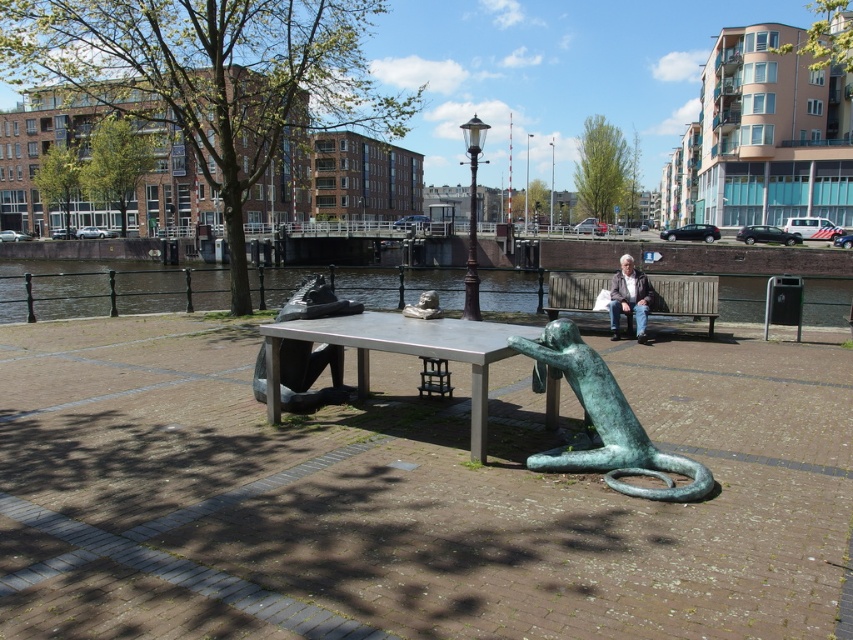
You are an artist planning to place a new sculpture between the polished stone statue at center and the matte brown jacket at center. Based on their widths, which object should you use as a reference to ensure the new sculpture fits proportionally?

The polished stone statue at center is thinner than the matte brown jacket at center, so you should use the matte brown jacket at center as the reference for the wider side to ensure the new sculpture fits proportionally.

In the scene shown: You are standing at the center of the paved area in the urban riverside scene. There is a polished stone statue marked by point (306, 376). If you walk straight ahead, will you reach the statue before the edge of the paved area?

The polished stone statue at center is represented by point (306, 376). Since you are already at the center, walking straight ahead would lead you directly to the statue before reaching the edge of the paved area.

You are standing in the urban riverside scene and want to move from point A to point B. Point A is at coordinates point [659,312] and point B is at point [614,330]. Which point is closer to you?

Point A at coordinates point [659,312] is closer to you since it is further to the viewer than point B at point [614,330].